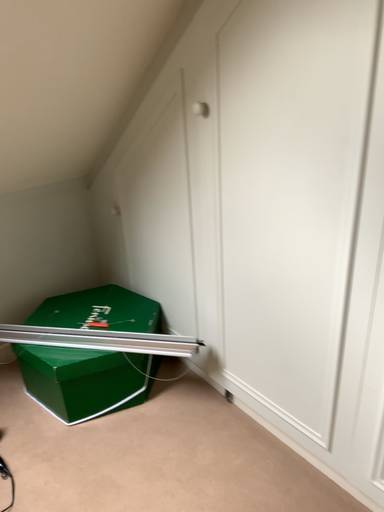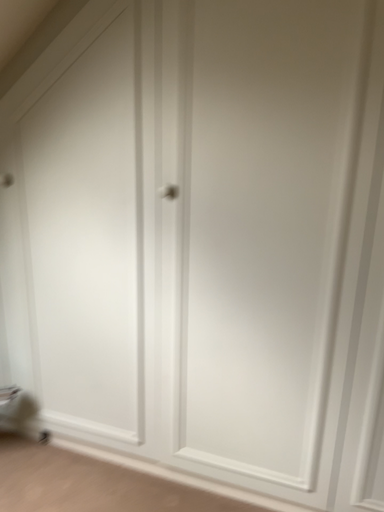
Question: Which way did the camera rotate in the video?

Choices:
 (A) rotated downward
 (B) rotated upward

Answer: (B)